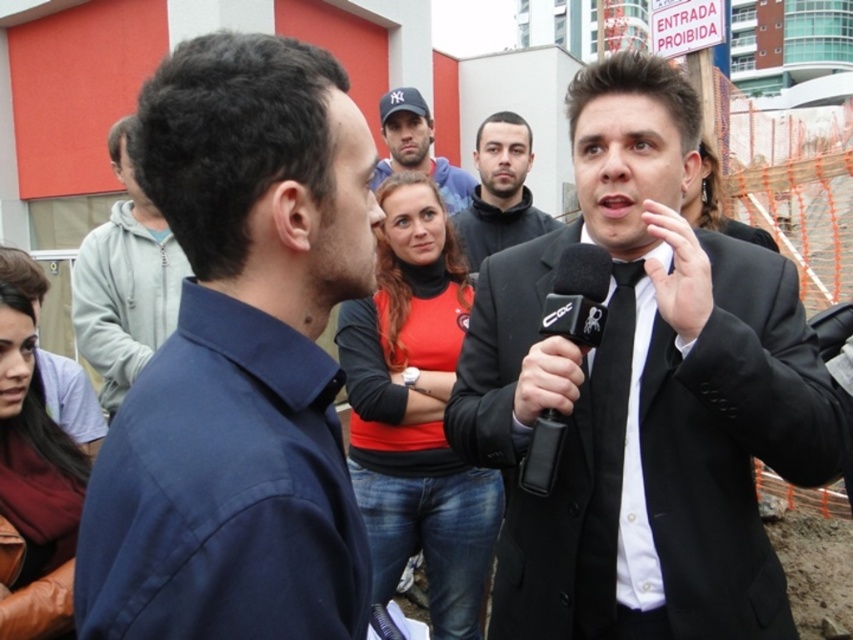
You are a photographer positioned behind the reporter. You need to capture a clear photo of the reporter and the interviewee without any obstructions. Which object between the black plastic microphone at center and the matte black cap at upper center might block your view?

The matte black cap at upper center is behind the black plastic microphone at center, so it might block your view if not positioned carefully.

You are a photographer at the event and need to capture a closeup shot of the reporter conducting the interview. Given that the black matte suit at center and the black plastic microphone at center are both in the frame, which object should you focus on to ensure the reporter is clearly visible?

The black matte suit at center is bigger than the black plastic microphone at center, so focusing on the black matte suit at center will ensure the reporter is clearly visible as it occupies more space in the frame.

You are a photographer at the event and need to ensure that both the black matte suit at center and the black plastic microphone at center are clearly visible in your photo. Given that the camera can only focus on objects wider than 10 cm, can you confirm if both objects meet this requirement?

The black matte suit at center is wider than the black plastic microphone at center. Since the microphone is narrower than the suit, but we don not have exact measurements, it is possible that the suit meets the 10 cm width requirement while the microphone might not. However, without specific dimensions, we cannot be certain.